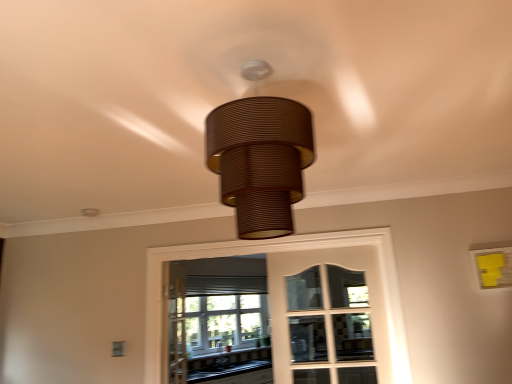
Question: Can you confirm if brown textured lampshade at center is shorter than clear glass window at center?

Choices:
 (A) yes
 (B) no

Answer: (A)

Question: Considering the relative positions of brown textured lampshade at center and clear glass window at center in the image provided, is brown textured lampshade at center to the left of clear glass window at center from the viewer's perspective?

Choices:
 (A) no
 (B) yes

Answer: (B)

Question: From a real-world perspective, is brown textured lampshade at center on clear glass window at center?

Choices:
 (A) no
 (B) yes

Answer: (B)

Question: Is brown textured lampshade at center at the right side of clear glass window at center?

Choices:
 (A) no
 (B) yes

Answer: (A)

Question: Is clear glass window at center surrounded by brown textured lampshade at center?

Choices:
 (A) yes
 (B) no

Answer: (B)

Question: In terms of width, does brown textured lampshade at center look wider or thinner when compared to matte glass bay window at center?

Choices:
 (A) thin
 (B) wide

Answer: (B)

Question: Does point (291, 137) appear closer or farther from the camera than point (234, 329)?

Choices:
 (A) farther
 (B) closer

Answer: (B)

Question: Based on their positions, is brown textured lampshade at center located to the left or right of matte glass bay window at center?

Choices:
 (A) left
 (B) right

Answer: (B)

Question: From the image's perspective, relative to matte glass bay window at center, is brown textured lampshade at center above or below?

Choices:
 (A) above
 (B) below

Answer: (A)

Question: Based on their sizes in the image, would you say brown textured lampshade at center is bigger or smaller than black laminate countertop at lower center?

Choices:
 (A) big
 (B) small

Answer: (B)

Question: Relative to black laminate countertop at lower center, is brown textured lampshade at center in front or behind?

Choices:
 (A) front
 (B) behind

Answer: (A)

Question: From a real-world perspective, is brown textured lampshade at center positioned above or below black laminate countertop at lower center?

Choices:
 (A) below
 (B) above

Answer: (B)

Question: Does point (263, 203) appear closer or farther from the camera than point (266, 367)?

Choices:
 (A) closer
 (B) farther

Answer: (A)

Question: In terms of width, does black laminate countertop at lower center look wider or thinner when compared to matte glass bay window at center?

Choices:
 (A) wide
 (B) thin

Answer: (A)

Question: Looking at the image, does black laminate countertop at lower center seem bigger or smaller compared to matte glass bay window at center?

Choices:
 (A) big
 (B) small

Answer: (A)